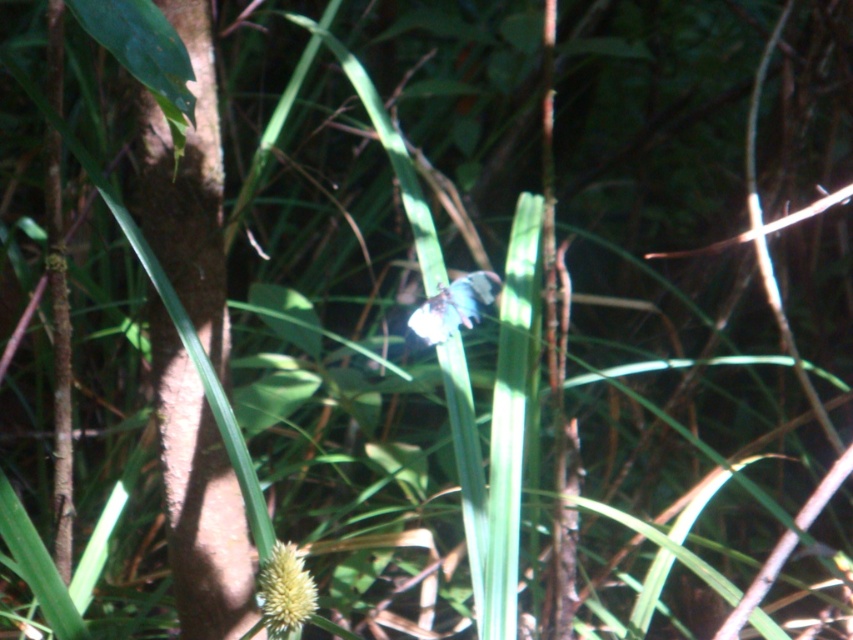
Question: Is white fuzzy flower at center positioned at the back of white matte flower at center?

Choices:
 (A) no
 (B) yes

Answer: (A)

Question: Where is white fuzzy flower at center located in relation to white matte flower at center in the image?

Choices:
 (A) left
 (B) right

Answer: (A)

Question: Can you confirm if white fuzzy flower at center is positioned to the left of white matte flower at center?

Choices:
 (A) no
 (B) yes

Answer: (B)

Question: Which object appears closest to the camera in this image?

Choices:
 (A) white matte flower at center
 (B) white fuzzy flower at center

Answer: (B)

Question: Which of the following is the farthest from the observer?

Choices:
 (A) white matte flower at center
 (B) white fuzzy flower at center

Answer: (A)